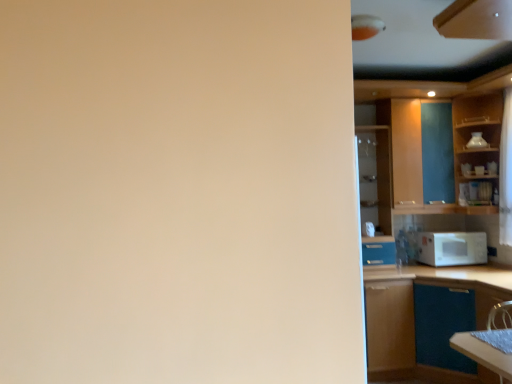
Question: Can you confirm if wooden cabinet at right, marked as the fourth cabinetry in a front-to-back arrangement, is wider than wooden cabinet at upper right, which is the first cabinetry from front to back?

Choices:
 (A) yes
 (B) no

Answer: (B)

Question: Is wooden cabinet at right, which appears as the second cabinetry when viewed from the back, at the left side of wooden cabinet at upper right, which is the first cabinetry from front to back?

Choices:
 (A) no
 (B) yes

Answer: (A)

Question: Is wooden cabinet at right, marked as the fourth cabinetry in a front-to-back arrangement, outside of wooden cabinet at upper right, which is the first cabinetry from front to back?

Choices:
 (A) no
 (B) yes

Answer: (B)

Question: Is wooden cabinet at right, which appears as the second cabinetry when viewed from the back, to the right of wooden cabinet at upper right, marked as the 5th cabinetry in a back-to-front arrangement, from the viewer's perspective?

Choices:
 (A) yes
 (B) no

Answer: (A)

Question: Is wooden cabinet at right, which appears as the second cabinetry when viewed from the back, oriented away from wooden cabinet at upper right, which is the first cabinetry from front to back?

Choices:
 (A) no
 (B) yes

Answer: (A)

Question: Considering the relative sizes of wooden cabinet at right, marked as the fourth cabinetry in a front-to-back arrangement, and wooden cabinet at upper right, which is the first cabinetry from front to back, in the image provided, is wooden cabinet at right, marked as the fourth cabinetry in a front-to-back arrangement, shorter than wooden cabinet at upper right, which is the first cabinetry from front to back,?

Choices:
 (A) yes
 (B) no

Answer: (B)

Question: Is white matte microwave at right touching brown matte cabinet at right, the 3th cabinetry positioned from the front?

Choices:
 (A) yes
 (B) no

Answer: (B)

Question: Does white matte microwave at right lie behind brown matte cabinet at right, the 3th cabinetry positioned from the front?

Choices:
 (A) no
 (B) yes

Answer: (B)

Question: From a real-world perspective, is white matte microwave at right below brown matte cabinet at right, the 3th cabinetry positioned from the front?

Choices:
 (A) yes
 (B) no

Answer: (B)

Question: Is white matte microwave at right far from brown matte cabinet at right, the 3th cabinetry positioned from the front?

Choices:
 (A) no
 (B) yes

Answer: (A)

Question: Does white matte microwave at right contain brown matte cabinet at right, the 3th cabinetry positioned from the front?

Choices:
 (A) no
 (B) yes

Answer: (A)

Question: Can you confirm if white matte microwave at right is wider than brown matte cabinet at right, the 3th cabinetry positioned from the front?

Choices:
 (A) yes
 (B) no

Answer: (B)

Question: Does white sheer curtain at right come in front of matte glass cabinet at right, arranged as the first cabinetry when viewed from the back?

Choices:
 (A) no
 (B) yes

Answer: (B)